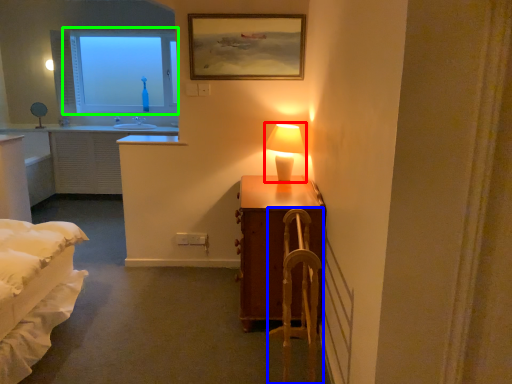
Question: Considering the real-world distances, which object is closest to table lamp (highlighted by a red box)? armchair (highlighted by a blue box) or window (highlighted by a green box).

Choices:
 (A) armchair
 (B) window

Answer: (A)